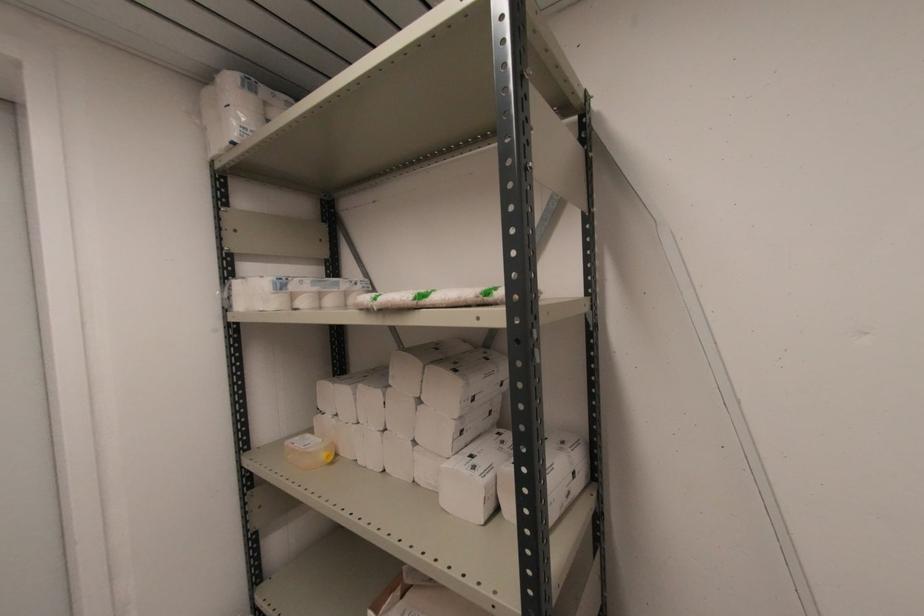
Describe the element at coordinates (309, 451) in the screenshot. The width and height of the screenshot is (924, 616). I see `the pump dispenser top` at that location.